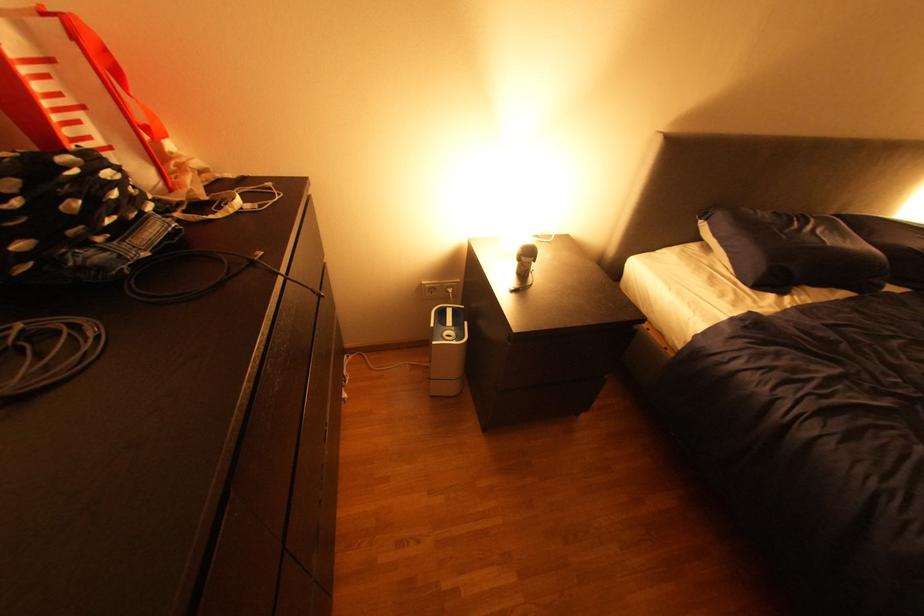
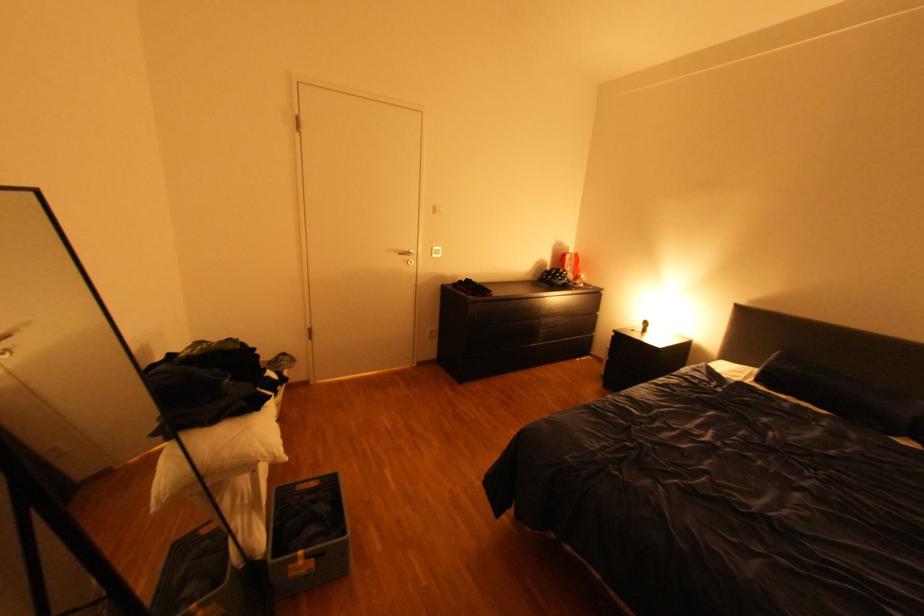
The point at (781, 294) is marked in the first image. Where is the corresponding point in the second image?

(771, 387)